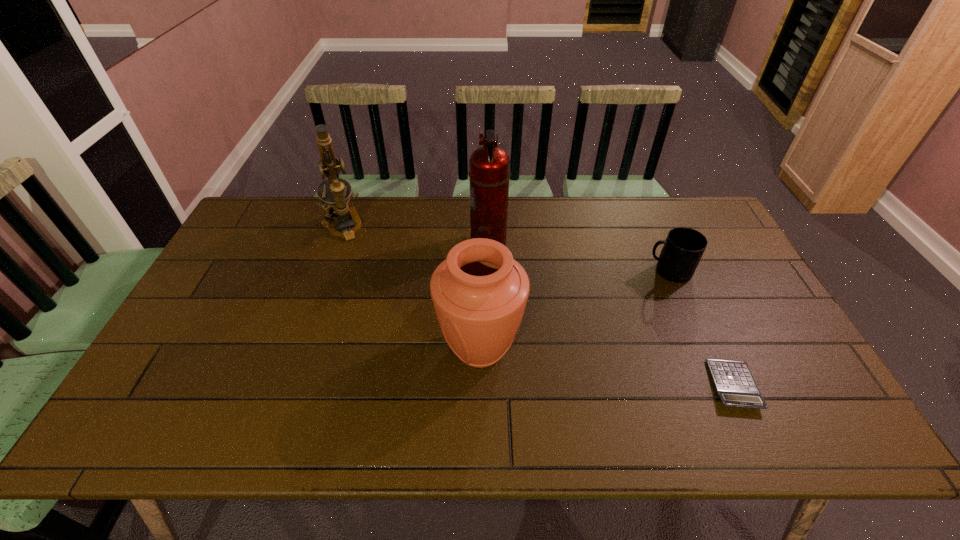
The height and width of the screenshot is (540, 960). I want to click on vacant region that satisfies the following two spatial constraints: 1. on the nozzle side of the fire extinguisher; 2. on the front side of the third shortest object, so click(x=491, y=348).